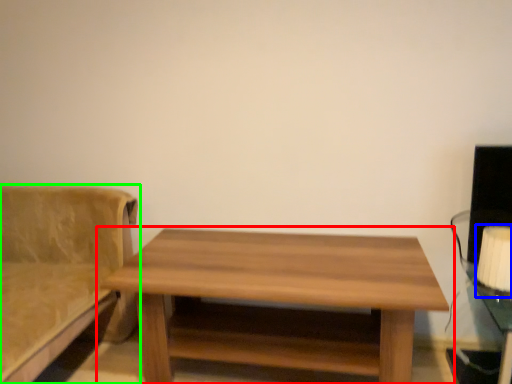
Question: Considering the real-world distances, which object is closest to table (highlighted by a red box)? table lamp (highlighted by a blue box) or studio couch (highlighted by a green box).

Choices:
 (A) table lamp
 (B) studio couch

Answer: (B)